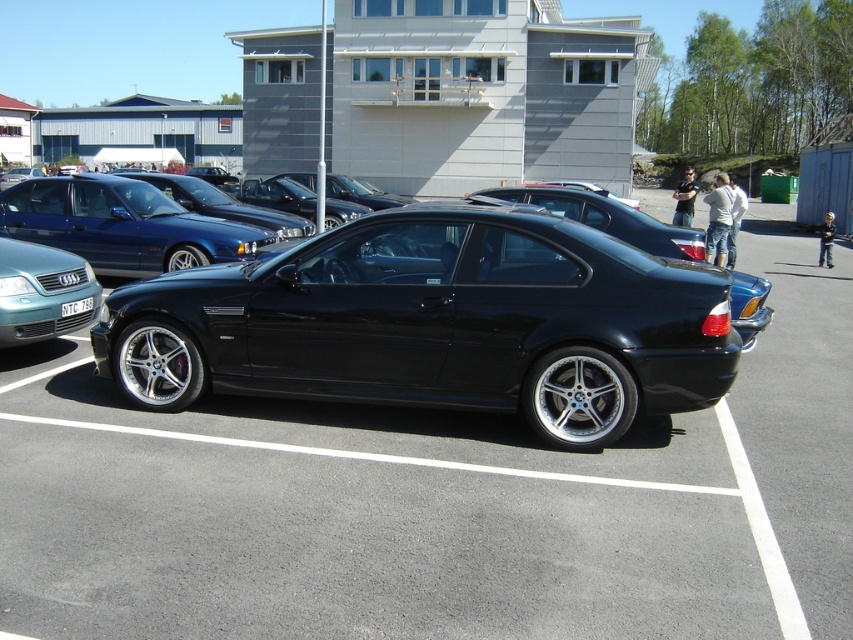
Question: Which point appears farthest from the camera in this image?

Choices:
 (A) (78, 236)
 (B) (845, 428)

Answer: (A)

Question: Can you confirm if black glossy car at center is positioned below metallic blue sedan at left?

Choices:
 (A) no
 (B) yes

Answer: (B)

Question: Which point is closer to the camera?

Choices:
 (A) matte blue sedan at left
 (B) white plastic license plate at center

Answer: (A)

Question: Observing the image, what is the correct spatial positioning of black metallic car at center in reference to matte blue sedan at left?

Choices:
 (A) right
 (B) left

Answer: (A)

Question: Considering the real-world distances, which object is farthest from the metallic blue sedan at left?

Choices:
 (A) black metallic car at center
 (B) white plastic license plate at center
 (C) black glossy car at center

Answer: (A)

Question: Can you confirm if black metallic car at center is positioned to the left of metallic blue sedan at left?

Choices:
 (A) no
 (B) yes

Answer: (A)